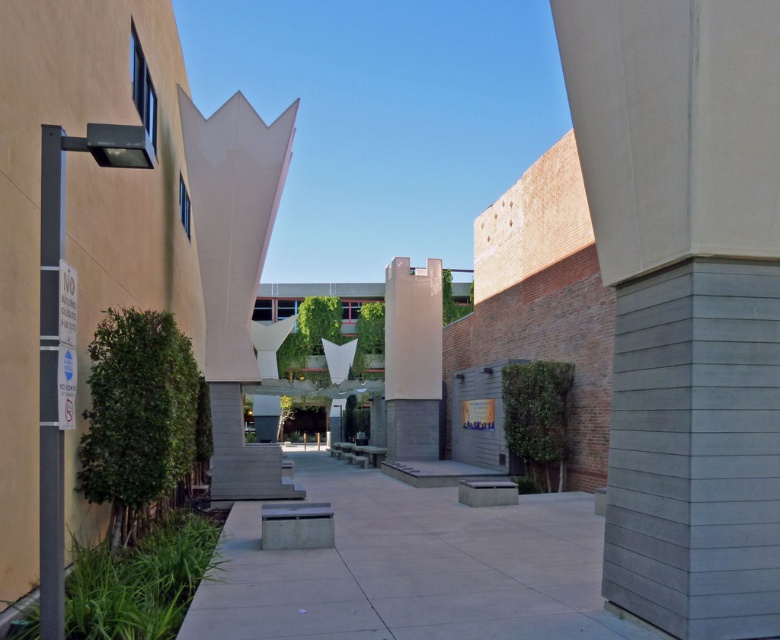
Does white concrete sculpture at center come in front of smooth concrete pillar at center?

Yes, it is.

Who is positioned more to the left, white concrete sculpture at center or smooth concrete pillar at center?

white concrete sculpture at center is more to the left.

Who is more distant from viewer, (240, 131) or (396, 432)?

Point (396, 432)

This screenshot has width=780, height=640. I want to click on white concrete sculpture at center, so click(234, 273).

Which of these two, gray concrete pillar at right or white concrete sculpture at center, stands taller?

Standing taller between the two is white concrete sculpture at center.

Which is below, gray concrete pillar at right or white concrete sculpture at center?

white concrete sculpture at center is below.

Describe the element at coordinates (685, 300) in the screenshot. The height and width of the screenshot is (640, 780). I see `gray concrete pillar at right` at that location.

Find the location of a particular element. gray concrete pillar at right is located at coordinates (685, 300).

Is gray concrete pillar at right bigger than smooth concrete pillar at center?

Yes, gray concrete pillar at right is bigger than smooth concrete pillar at center.

In the scene shown: Is gray concrete pillar at right positioned in front of smooth concrete pillar at center?

Yes, gray concrete pillar at right is closer to the viewer.

Is point (661, 358) farther from viewer compared to point (385, 396)?

No.

Image resolution: width=780 pixels, height=640 pixels. I want to click on gray concrete pillar at right, so (685, 300).